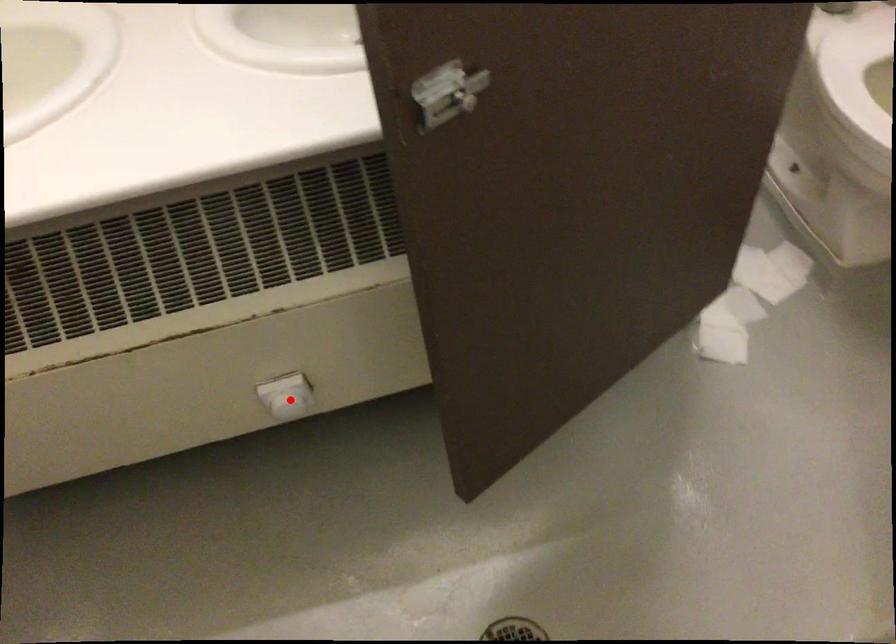
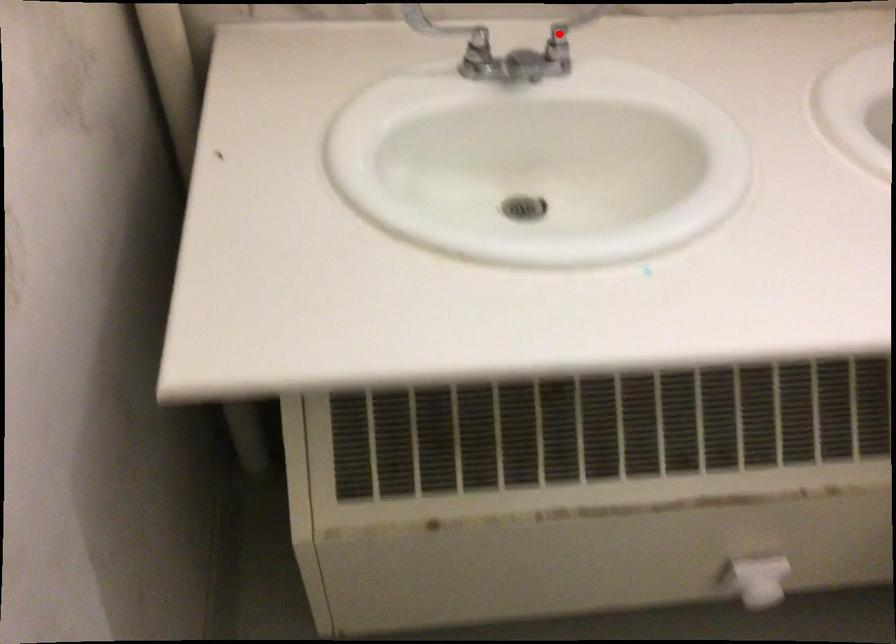
I am providing you with two images of the same scene from different viewpoints. A red point is marked on the first image and another point is marked on the second image. Is the marked point in image1 the same physical position as the marked point in image2?

No